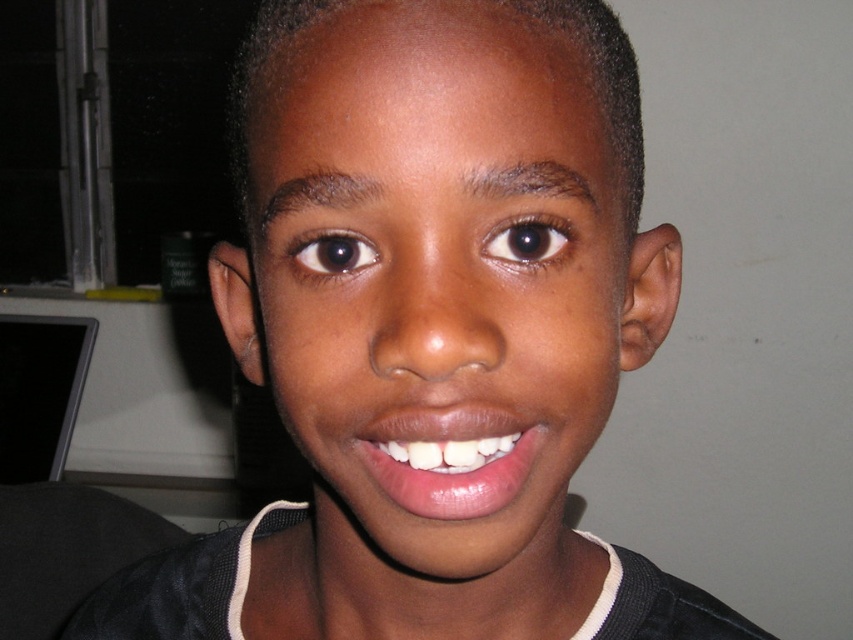
Question: Which object is the closest to the smooth glossy lips at center?

Choices:
 (A) brown matte eye at upper center
 (B) brown shiny eye at center

Answer: (A)

Question: Which point is farther to the camera?

Choices:
 (A) smooth glossy lips at center
 (B) brown shiny eye at center
 (C) brown matte eye at upper center

Answer: (B)

Question: Does brown matte eye at upper center have a larger size compared to brown shiny eye at center?

Choices:
 (A) yes
 (B) no

Answer: (B)

Question: Is smooth glossy lips at center to the left of brown shiny eye at center from the viewer's perspective?

Choices:
 (A) no
 (B) yes

Answer: (A)

Question: Is smooth glossy lips at center to the left of brown shiny eye at center from the viewer's perspective?

Choices:
 (A) yes
 (B) no

Answer: (B)

Question: Which of the following is the farthest from the observer?

Choices:
 (A) (355, 248)
 (B) (412, 467)

Answer: (A)